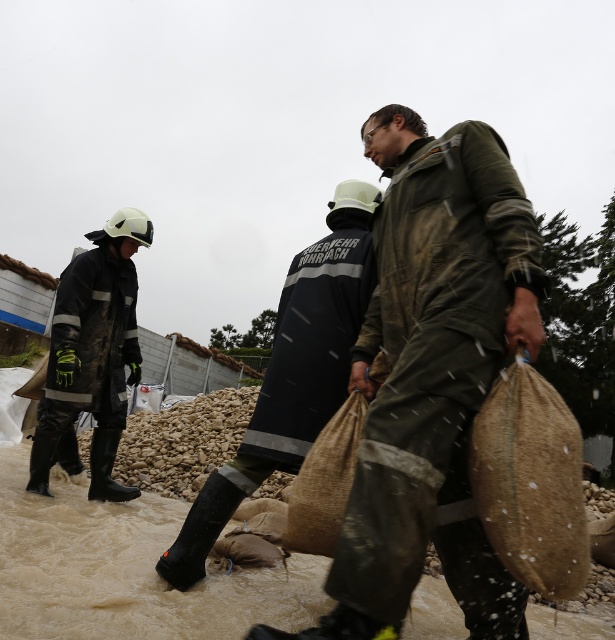
You are a photographer trying to capture a photo of the green matte jacket at center and the rubberized black boots at left. Based on their positions, which object should you focus on first if you want to include both in the frame without moving the camera?

The rubberized black boots at left should be focused on first because the green matte jacket at center is to the right of it, so focusing on the leftmost object ensures both are in frame.

From the picture: You are a photographer trying to capture the flood relief efforts. You notice the burlap sack at lower right and the rubberized black boots at left. Which object would require a closer camera focus to fill the frame, and why?

The burlap sack at lower right would require a closer camera focus to fill the frame because it occupies less space than the rubberized black boots at left.

You are a photographer trying to capture the scene of flood relief efforts. You notice the green matte jacket at center and the rubberized black boots at left in your frame. Which object appears narrower in your photo?

The green matte jacket at center appears narrower than the rubberized black boots at left in the photo.